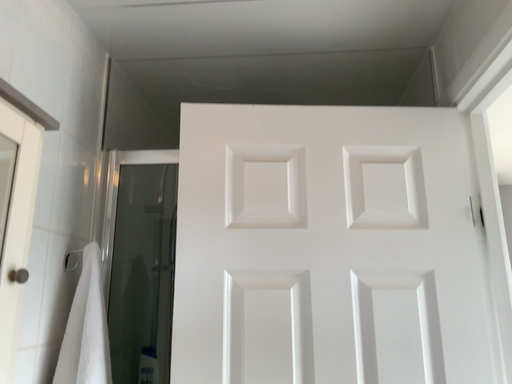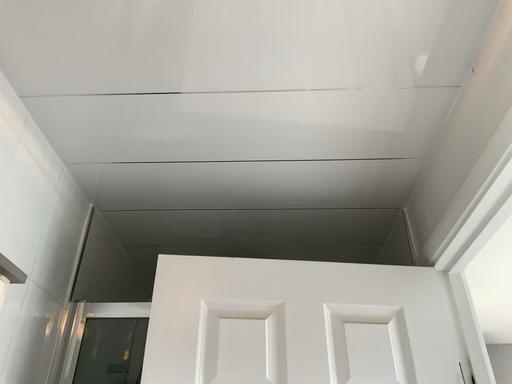
Question: How did the camera likely rotate when shooting the video?

Choices:
 (A) rotated upward
 (B) rotated downward

Answer: (A)